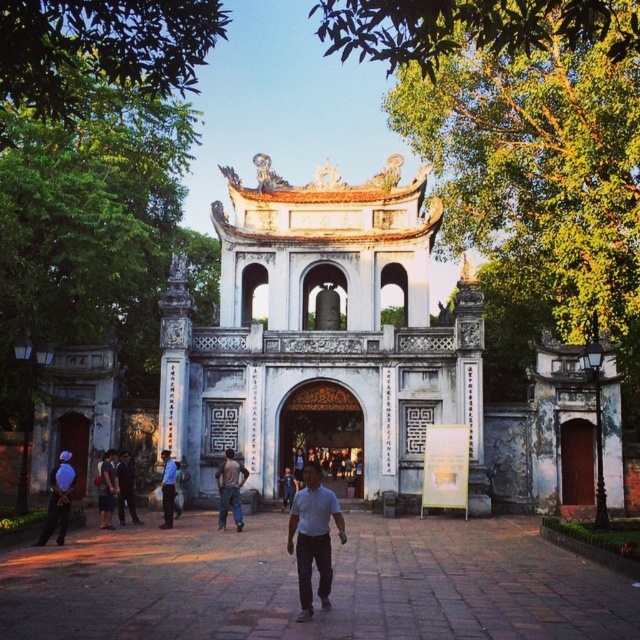
Question: Which object is positioned farthest from the white stone gate at center?

Choices:
 (A) brown wooden gate at center
 (B) dark blue shirt at center
 (C) blue shirt at center

Answer: (B)

Question: Can you confirm if white stone gate at center is bigger than brown wooden gate at center?

Choices:
 (A) yes
 (B) no

Answer: (A)

Question: Which object appears farthest from the camera in this image?

Choices:
 (A) brown wooden gate at center
 (B) light blue shirt at center

Answer: (A)

Question: Estimate the real-world distances between objects in this image. Which object is farther from the white stone gate at center?

Choices:
 (A) denim jacket at left
 (B) blue fabric at left
 (C) dark blue jeans at center
 (D) brown wooden gate at center

Answer: (B)

Question: Does brick pavement at center have a smaller size compared to blue fabric at left?

Choices:
 (A) no
 (B) yes

Answer: (A)

Question: Is brown wooden gate at center thinner than dark blue jeans at center?

Choices:
 (A) yes
 (B) no

Answer: (B)